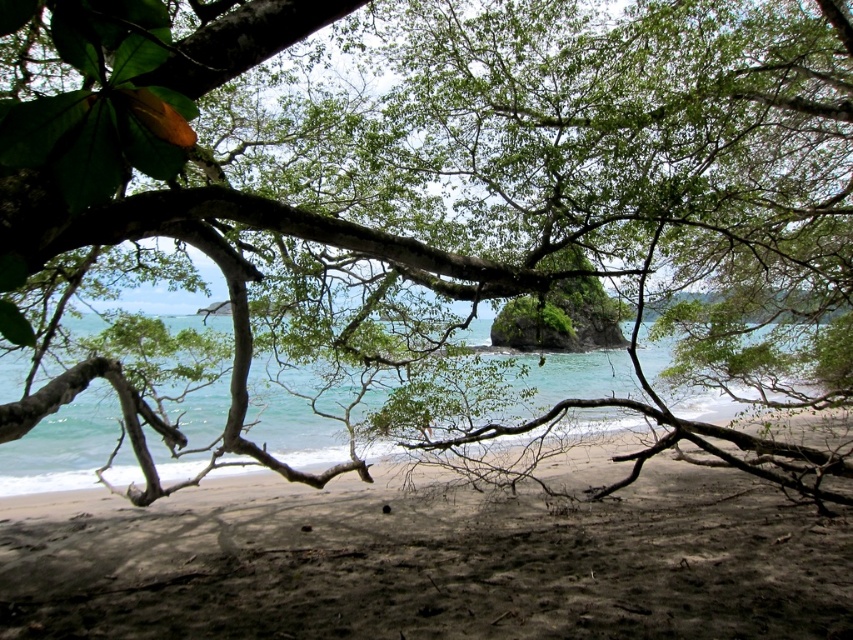
Is point (103, 595) more distant than point (688, 408)?

That is False.

Is dark brown sandy beach at center shorter than clear blue water at center?

Indeed, dark brown sandy beach at center has a lesser height compared to clear blue water at center.

Is point (583, 522) farther from camera compared to point (341, 432)?

That is False.

Identify the location of dark brown sandy beach at center. (434, 564).